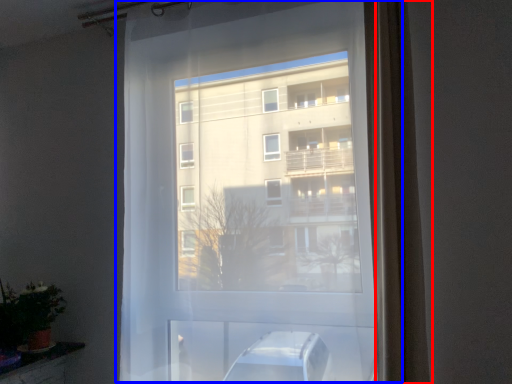
Question: Among these objects, which one is farthest to the camera, curtain (highlighted by a red box) or window (highlighted by a blue box)?

Choices:
 (A) curtain
 (B) window

Answer: (B)